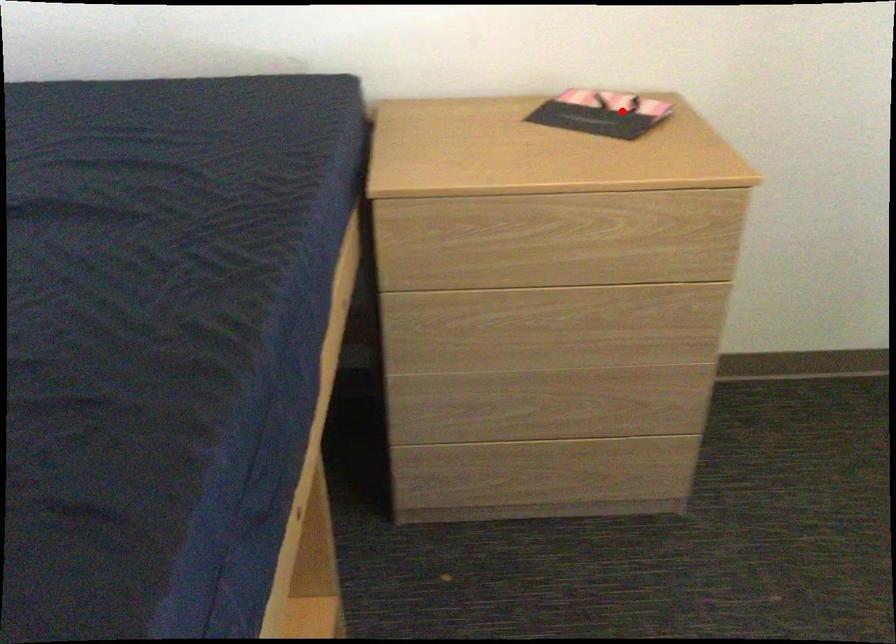
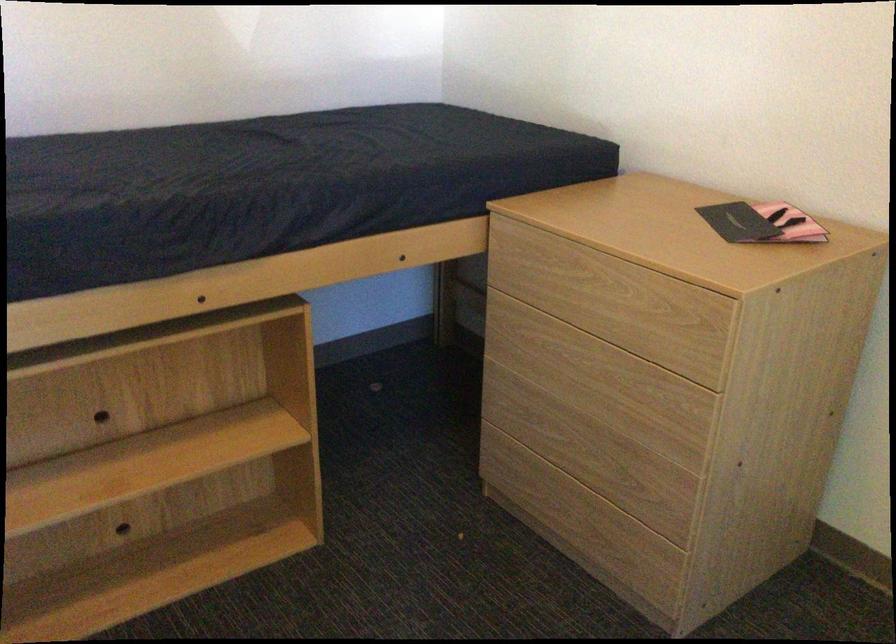
Find the pixel in the second image that matches the highlighted location in the first image.

(762, 223)